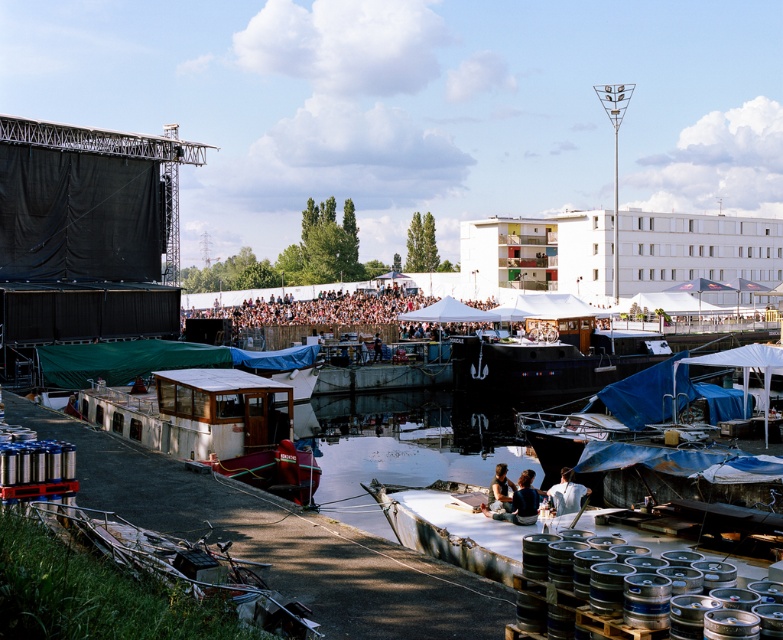
You are standing at point [152,401] and want to walk to the stage area behind the wooden fence. The shortest path requires crossing a field that is 128.66 feet wide. If your average walking speed is 3 feet per second, how many seconds will it take you to reach the stage?

The distance between you and the stage is 128.66 feet. At a walking speed of 3 feet per second, dividing the distance by the speed gives 128.66 divided by 3, which equals approximately 42.89 seconds. Therefore, it will take roughly 43 seconds to reach the stage.

You are planning to transport a group of 10 people to a nearby island. You have access to both the white wooden boat at center and the blue tarpaulin boat at lower right. Based on their sizes, which boat would be more suitable for accommodating everyone comfortably?

The white wooden boat at center is wider than the blue tarpaulin boat at lower right, so it would be more suitable for accommodating 10 people comfortably.